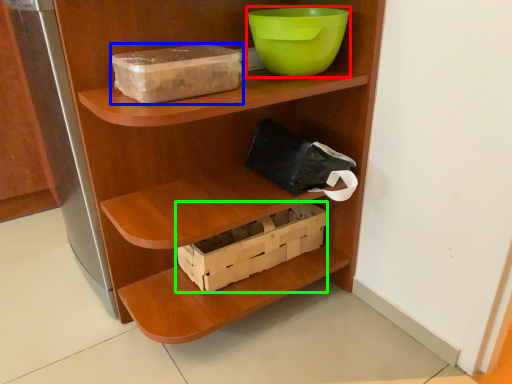
Question: Which object is positioned farthest from bowl (highlighted by a red box)? Select from storage box (highlighted by a blue box) and box (highlighted by a green box).

Choices:
 (A) storage box
 (B) box

Answer: (B)